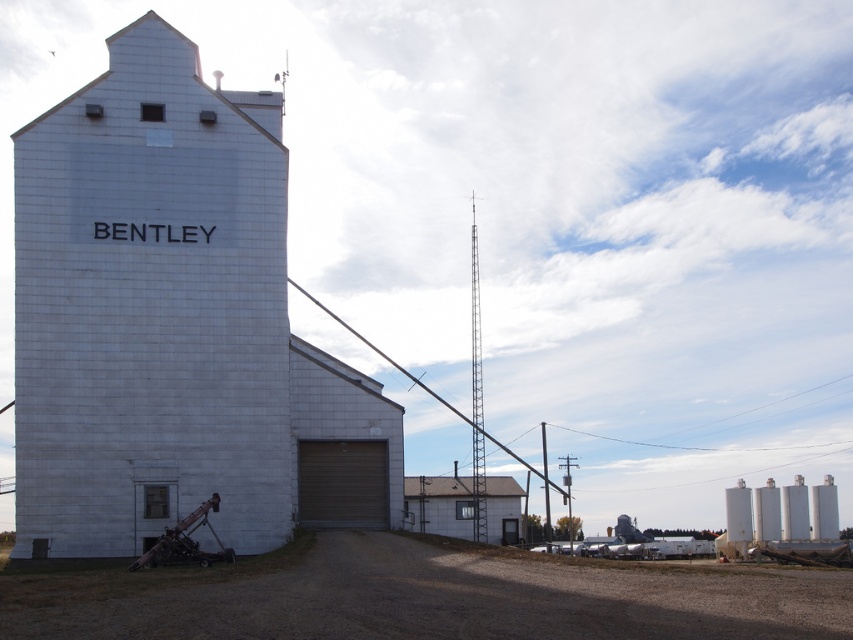
You are a farmer planning to park a large tractor between the white concrete grain silo at center and the gray metal building at center. Based on their widths, can you determine if there will be enough space for the tractor to fit between them?

The white concrete grain silo at center might be wider than gray metal building at center, so there may not be enough space for the tractor to fit between them. Check the actual dimensions before deciding.

You are a farmer who needs to move a heavy piece of equipment from the white concrete grain silo at center to the gray metal building at center. The equipment requires a clear path with at least 15 meters of space between the two structures. Can you safely move the equipment along this path?

The distance between the white concrete grain silo at center and the gray metal building at center is 18.46 meters, which exceeds the required 15 meters. Therefore, you can safely move the equipment along this path.